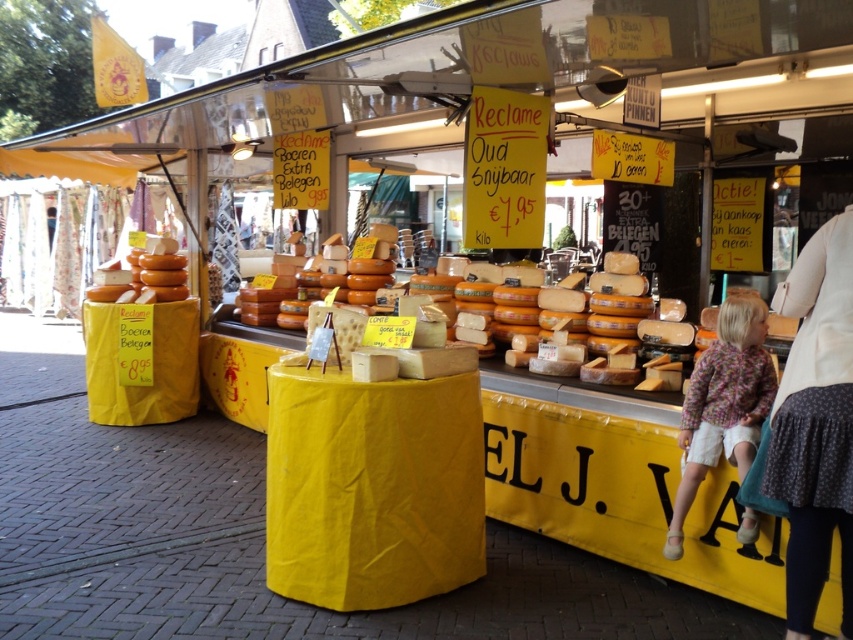
Question: Estimate the real-world distances between objects in this image. Which object is farther from the floral-patterned fabric at lower right?

Choices:
 (A) orange cheese at center
 (B) matte brown cheese at center
 (C) floral fabric skirt at lower right

Answer: (B)

Question: In this image, where is orange cheese at center located relative to matte brown cheese at center?

Choices:
 (A) left
 (B) right

Answer: (B)

Question: Estimate the real-world distances between objects in this image. Which object is farther from the floral fabric skirt at lower right?

Choices:
 (A) matte brown cheese at center
 (B) floral-patterned fabric at lower right
 (C) orange cheese at center

Answer: (A)

Question: Is floral-patterned fabric at lower right below matte brown cheese at center?

Choices:
 (A) no
 (B) yes

Answer: (B)

Question: Is floral-patterned fabric at lower right bigger than orange cheese at center?

Choices:
 (A) yes
 (B) no

Answer: (B)

Question: Considering the real-world distances, which object is closest to the matte brown cheese at center?

Choices:
 (A) floral-patterned fabric at lower right
 (B) floral fabric skirt at lower right
 (C) orange cheese at center

Answer: (C)